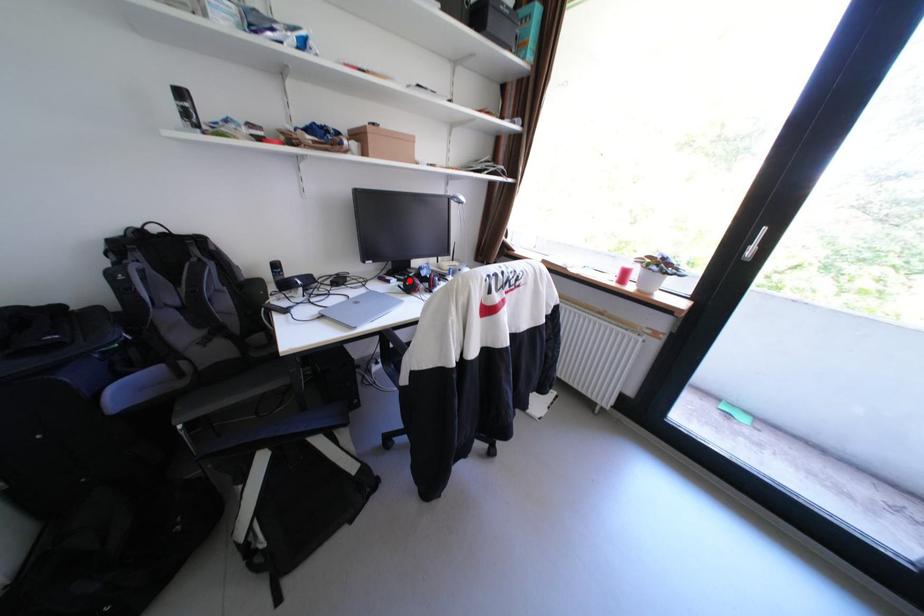
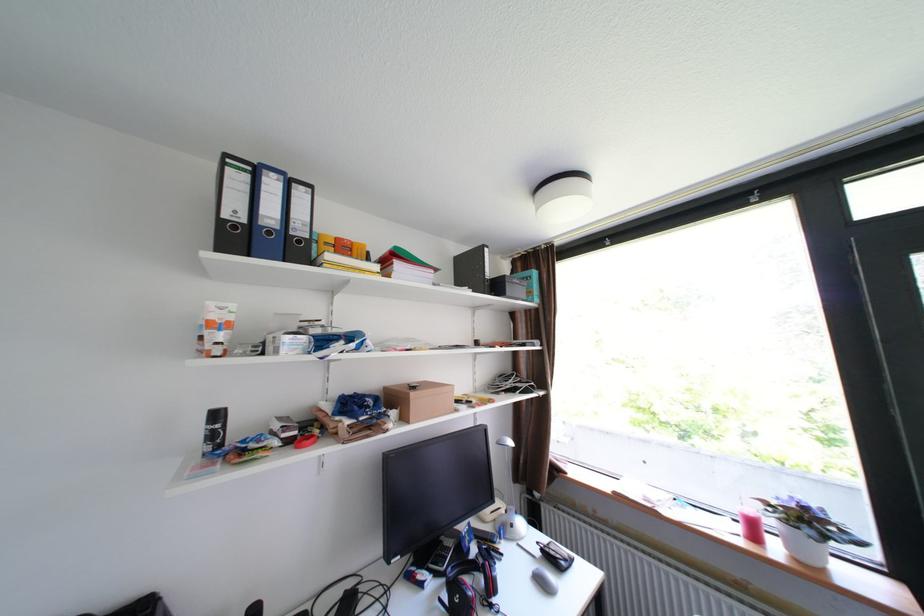
In the second image, find the point that corresponds to the highlighted location in the first image.

(446, 576)